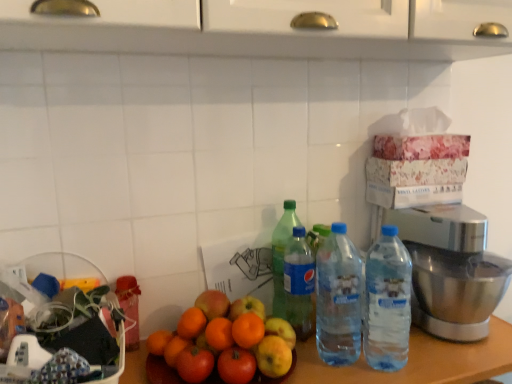
Identify the location of empty space that is to the right of blue plastic water bottle at center, which is the 3th bottle from left to right. The image size is (512, 384). click(x=414, y=353).